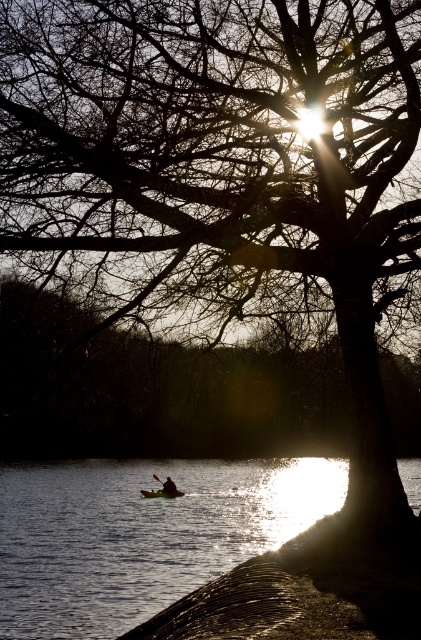
Between silvery reflective water at lower left and black rubber paddle at center, which one is positioned higher?

silvery reflective water at lower left is higher up.

Can you confirm if silvery reflective water at lower left is shorter than black rubber paddle at center?

In fact, silvery reflective water at lower left may be taller than black rubber paddle at center.

Locate an element on the screen. silvery reflective water at lower left is located at coordinates tap(141, 534).

Which is more to the right, dark brown leather kayak at center or black rubber paddle at center?

From the viewer's perspective, dark brown leather kayak at center appears more on the right side.

Does dark brown leather kayak at center have a greater width compared to black rubber paddle at center?

Yes, dark brown leather kayak at center is wider than black rubber paddle at center.

Describe the element at coordinates (170, 486) in the screenshot. The image size is (421, 640). I see `dark brown leather kayak at center` at that location.

This screenshot has width=421, height=640. What are the coordinates of `dark brown leather kayak at center` in the screenshot? It's located at (170, 486).

From the picture: Which of these two, silvery reflective water at lower left or dark brown leather kayak at center, stands shorter?

dark brown leather kayak at center is shorter.

Looking at this image, measure the distance between point (106, 557) and camera.

Point (106, 557) is 69.43 feet from camera.

Between point (8, 547) and point (167, 492), which one is positioned behind?

Positioned behind is point (167, 492).

Where is `silvery reflective water at lower left`? The height and width of the screenshot is (640, 421). silvery reflective water at lower left is located at coordinates (141, 534).